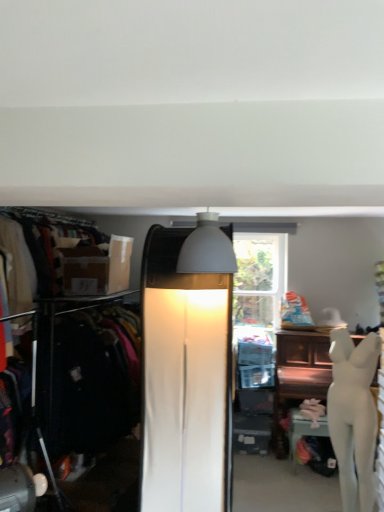
Question: From the image's perspective, does white glossy mannequin at lower right appear higher than matte brown box at left?

Choices:
 (A) no
 (B) yes

Answer: (A)

Question: Is white glossy mannequin at lower right facing away from matte brown box at left?

Choices:
 (A) no
 (B) yes

Answer: (A)

Question: From a real-world perspective, does white glossy mannequin at lower right sit lower than matte brown box at left?

Choices:
 (A) yes
 (B) no

Answer: (A)

Question: Can you confirm if white glossy mannequin at lower right is positioned to the right of matte brown box at left?

Choices:
 (A) yes
 (B) no

Answer: (A)

Question: Is white glossy mannequin at lower right bigger than matte brown box at left?

Choices:
 (A) yes
 (B) no

Answer: (B)

Question: From the image's perspective, is matte brown box at left above or below white glossy mannequin at lower right?

Choices:
 (A) below
 (B) above

Answer: (B)

Question: Is matte brown box at left bigger or smaller than white glossy mannequin at lower right?

Choices:
 (A) big
 (B) small

Answer: (A)

Question: Is matte brown box at left taller or shorter than white glossy mannequin at lower right?

Choices:
 (A) tall
 (B) short

Answer: (B)

Question: In the image, is matte brown box at left positioned in front of or behind white glossy mannequin at lower right?

Choices:
 (A) behind
 (B) front

Answer: (A)

Question: In terms of width, does white glossy statue at right look wider or thinner when compared to matte white lamp at center, which is the 2th lamp from front to back?

Choices:
 (A) wide
 (B) thin

Answer: (B)

Question: Looking at the image, does white glossy statue at right seem bigger or smaller compared to matte white lamp at center, the second lamp viewed from the top?

Choices:
 (A) small
 (B) big

Answer: (A)

Question: From a real-world perspective, is white glossy statue at right above or below matte white lamp at center, the second lamp viewed from the top?

Choices:
 (A) above
 (B) below

Answer: (B)

Question: Choose the correct answer: Is white glossy statue at right inside matte white lamp at center, which is the 2th lamp from front to back, or outside it?

Choices:
 (A) outside
 (B) inside

Answer: (A)

Question: Looking at the image, does matte black clothing rack at left seem bigger or smaller compared to white matte lampshade at upper center, which appears as the 1th lamp when viewed from the front?

Choices:
 (A) small
 (B) big

Answer: (B)

Question: From a real-world perspective, relative to white matte lampshade at upper center, arranged as the 2th lamp when ordered from the bottom, is matte black clothing rack at left vertically above or below?

Choices:
 (A) below
 (B) above

Answer: (A)